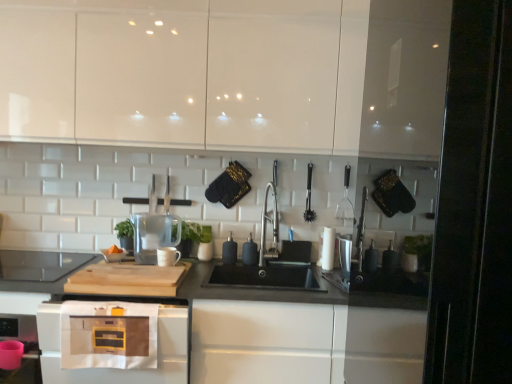
What do you see at coordinates (168, 256) in the screenshot? Image resolution: width=512 pixels, height=384 pixels. I see `white glossy mug at center, positioned as the fifth appliance in right-to-left order` at bounding box center [168, 256].

Locate an element on the screen. The image size is (512, 384). glossy white cabinets at upper center is located at coordinates (228, 74).

What do you see at coordinates (265, 228) in the screenshot? I see `satin nickel faucet at center` at bounding box center [265, 228].

What is the approximate width of matte black cooktop at left?

matte black cooktop at left is 52.77 centimeters wide.

This screenshot has height=384, width=512. Describe the element at coordinates (127, 279) in the screenshot. I see `natural wood cutting board at center` at that location.

This screenshot has height=384, width=512. I want to click on black matte countertop at center, so (x=304, y=343).

Identify the location of white glossy mug at center, positioned as the fifth appliance in right-to-left order. (168, 256).

Where is `home appliance in front of the black matte soap dispenser at center, which appears as the third appliance when viewed from the left`? This screenshot has height=384, width=512. home appliance in front of the black matte soap dispenser at center, which appears as the third appliance when viewed from the left is located at coordinates (112, 368).

Is black matte soap dispenser at center, which ranks as the fourth appliance in right-to-left order, positioned with its back to matte white microwave at lower left?

black matte soap dispenser at center, which ranks as the fourth appliance in right-to-left order, does not have its back to matte white microwave at lower left.

From the picture: From a real-world perspective, which object stands above the other?

black matte soap dispenser at center, which ranks as the fourth appliance in right-to-left order, from a real-world perspective.

Which point is more forward, (229, 238) or (52, 326)?

The point (52, 326) is in front.

Image resolution: width=512 pixels, height=384 pixels. What are the coordinates of `countertop beneath the black matte soap dispenser at center, acting as the 4th appliance starting from the left (from a real-world perspective)` in the screenshot? It's located at (304, 343).

Is black matte soap dispenser at center, positioned as the 3th appliance in right-to-left order, directly adjacent to black matte countertop at center?

No, black matte soap dispenser at center, positioned as the 3th appliance in right-to-left order, is not making contact with black matte countertop at center.

From the image's perspective, is black matte soap dispenser at center, acting as the 4th appliance starting from the left, located above or below black matte countertop at center?

Clearly, from the image's perspective, black matte soap dispenser at center, acting as the 4th appliance starting from the left, is above black matte countertop at center.

Is point (49, 380) farther from camera compared to point (232, 247)?

No, (49, 380) is in front of (232, 247).

From the image's perspective, is matte white microwave at lower left under black matte soap dispenser at center, which ranks as the fourth appliance in right-to-left order?

Indeed, from the image's perspective, matte white microwave at lower left is shown beneath black matte soap dispenser at center, which ranks as the fourth appliance in right-to-left order.

Is matte white microwave at lower left not near black matte soap dispenser at center, which ranks as the fourth appliance in right-to-left order?

matte white microwave at lower left is actually quite close to black matte soap dispenser at center, which ranks as the fourth appliance in right-to-left order.

From a real-world perspective, does matte white microwave at lower left sit lower than black matte soap dispenser at center, which ranks as the fourth appliance in right-to-left order?

Correct, in the physical world, matte white microwave at lower left is lower than black matte soap dispenser at center, which ranks as the fourth appliance in right-to-left order.

From the image's perspective, between black matte soap dispenser at center, which ranks as the fourth appliance in right-to-left order, and natural wood cutting board at center, who is located below?

From the image's view, natural wood cutting board at center is below.

Is black matte soap dispenser at center, which appears as the third appliance when viewed from the left, not close to natural wood cutting board at center?

black matte soap dispenser at center, which appears as the third appliance when viewed from the left, is near natural wood cutting board at center, not far away.

The width and height of the screenshot is (512, 384). Identify the location of appliance that is the 3rd object above the natural wood cutting board at center (from a real-world perspective). (229, 251).

From a real-world perspective, does black matte soap dispenser at center, which ranks as the fourth appliance in right-to-left order, stand above natural wood cutting board at center?

Indeed, from a real-world perspective, black matte soap dispenser at center, which ranks as the fourth appliance in right-to-left order, stands above natural wood cutting board at center.

From the image's perspective, between black matte countertop at center and black rubber brush at center, acting as the 5th appliance starting from the left, which one is located above?

black rubber brush at center, acting as the 5th appliance starting from the left.

Considering the sizes of objects black matte countertop at center and black rubber brush at center, acting as the 5th appliance starting from the left, in the image provided, who is smaller, black matte countertop at center or black rubber brush at center, acting as the 5th appliance starting from the left,?

black rubber brush at center, acting as the 5th appliance starting from the left, is smaller.

From a real-world perspective, is black matte countertop at center physically below black rubber brush at center, acting as the 5th appliance starting from the left?

Yes.

Is black rubber brush at center, acting as the 5th appliance starting from the left, located within black matte countertop at center?

That's incorrect, black rubber brush at center, acting as the 5th appliance starting from the left, is not inside black matte countertop at center.

In terms of height, does black matte countertop at center look taller or shorter compared to black matte soap dispenser at center, which ranks as the fourth appliance in right-to-left order?

Considering their sizes, black matte countertop at center has more height than black matte soap dispenser at center, which ranks as the fourth appliance in right-to-left order.

From the image's perspective, is black matte countertop at center located above black matte soap dispenser at center, which appears as the third appliance when viewed from the left?

No, from the image's perspective, black matte countertop at center is not above black matte soap dispenser at center, which appears as the third appliance when viewed from the left.

Is black matte countertop at center inside or outside of black matte soap dispenser at center, which appears as the third appliance when viewed from the left?

black matte countertop at center lies outside black matte soap dispenser at center, which appears as the third appliance when viewed from the left.

How different are the orientations of glossy white cabinets at upper center and black matte soap dispenser at center, which ranks as the fourth appliance in right-to-left order, in degrees?

They differ by 0.627 degrees in their facing directions.

Which object is positioned more to the left, glossy white cabinets at upper center or black matte soap dispenser at center, which ranks as the fourth appliance in right-to-left order?

glossy white cabinets at upper center.

Does glossy white cabinets at upper center have a larger size compared to black matte soap dispenser at center, which ranks as the fourth appliance in right-to-left order?

Yes, glossy white cabinets at upper center is bigger than black matte soap dispenser at center, which ranks as the fourth appliance in right-to-left order.

There is a matte white microwave at lower left. At what (x,y) coordinates should I click in order to perform the action: click on the 3rd appliance above it (from the image's perspective). Please return your answer as a coordinate pair (x, y). Looking at the image, I should click on (229, 251).

Where is `countertop located on the left of black matte soap dispenser at center, positioned as the 3th appliance in right-to-left order`? The width and height of the screenshot is (512, 384). countertop located on the left of black matte soap dispenser at center, positioned as the 3th appliance in right-to-left order is located at coordinates click(304, 343).

Estimate the real-world distances between objects in this image. Which object is closer to black plastic spatula at upper right, which ranks as the sixth appliance in left-to-right order, black rubber brush at center, placed as the 2th appliance when sorted from right to left, or glossy white cabinets at upper center?

black rubber brush at center, placed as the 2th appliance when sorted from right to left, is positioned closer to the anchor black plastic spatula at upper right, which ranks as the sixth appliance in left-to-right order.

Based on their spatial positions, is satin nickel faucet at center or glossy white cabinets at upper center further from black matte countertop at center?

Among the two, glossy white cabinets at upper center is located further to black matte countertop at center.

Which object lies nearer to the anchor point glossy white cabinets at upper center, white glossy mug at center, arranged as the second appliance when viewed from the left, or black plastic spatula at upper right, positioned as the 1th appliance in right-to-left order?

black plastic spatula at upper right, positioned as the 1th appliance in right-to-left order, is positioned closer to the anchor glossy white cabinets at upper center.

Estimate the real-world distances between objects in this image. Which object is closer to black matte soap dispenser at center, positioned as the 3th appliance in right-to-left order, black plastic spatula at upper right, positioned as the 1th appliance in right-to-left order, or black matte soap dispenser at center, which ranks as the fourth appliance in right-to-left order?

Based on the image, black matte soap dispenser at center, which ranks as the fourth appliance in right-to-left order, appears to be nearer to black matte soap dispenser at center, positioned as the 3th appliance in right-to-left order.

When comparing their distances from black matte soap dispenser at center, acting as the 4th appliance starting from the left, does black plastic spatula at upper right, which ranks as the sixth appliance in left-to-right order, or black rubber brush at center, acting as the 5th appliance starting from the left, seem closer?

Among the two, black rubber brush at center, acting as the 5th appliance starting from the left, is located nearer to black matte soap dispenser at center, acting as the 4th appliance starting from the left.

When comparing their distances from transparent glass pitcher at center, which is the 1th appliance from left to right, does black matte soap dispenser at center, positioned as the 3th appliance in right-to-left order, or matte black cooktop at left seem closer?

matte black cooktop at left is closer to transparent glass pitcher at center, which is the 1th appliance from left to right.

Estimate the real-world distances between objects in this image. Which object is closer to black plastic spatula at upper right, positioned as the 1th appliance in right-to-left order, matte white microwave at lower left or black matte soap dispenser at center, which appears as the third appliance when viewed from the left?

black matte soap dispenser at center, which appears as the third appliance when viewed from the left, lies closer to black plastic spatula at upper right, positioned as the 1th appliance in right-to-left order, than the other object.

From the image, which object appears to be farther from black plastic spatula at upper right, positioned as the 1th appliance in right-to-left order, black rubber brush at center, placed as the 2th appliance when sorted from right to left, or black matte countertop at center?

black matte countertop at center is further to black plastic spatula at upper right, positioned as the 1th appliance in right-to-left order.

Find the location of a particular element. The image size is (512, 384). faucet between white glossy mug at center, positioned as the fifth appliance in right-to-left order, and black rubber brush at center, acting as the 5th appliance starting from the left, from left to right is located at coordinates (265, 228).

Where is `home appliance between white glossy mug at center, arranged as the second appliance when viewed from the left, and black matte countertop at center, in the vertical direction`? The width and height of the screenshot is (512, 384). home appliance between white glossy mug at center, arranged as the second appliance when viewed from the left, and black matte countertop at center, in the vertical direction is located at coordinates (112, 368).

Find the location of a particular element. countertop between white glossy mug at center, positioned as the fifth appliance in right-to-left order, and black plastic spatula at upper right, which ranks as the sixth appliance in left-to-right order, in the horizontal direction is located at coordinates (304, 343).

Identify the location of cutting board situated between matte black cooktop at left and black matte soap dispenser at center, positioned as the 3th appliance in right-to-left order, from left to right. This screenshot has height=384, width=512. (127, 279).